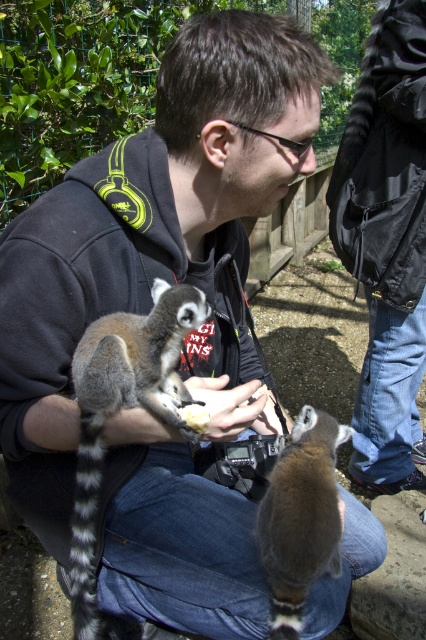
What do you see at coordinates (123, 406) in the screenshot? I see `ring-tailed lemur at left` at bounding box center [123, 406].

Does ring-tailed lemur at left appear on the right side of ring-tailed lemur at center?

In fact, ring-tailed lemur at left is to the left of ring-tailed lemur at center.

Find the location of a particular element. This screenshot has width=426, height=640. ring-tailed lemur at left is located at coordinates (123, 406).

This screenshot has width=426, height=640. In order to click on ring-tailed lemur at left in this screenshot , I will do `click(123, 406)`.

Is black synthetic jacket at upper right below ring-tailed lemur at left?

Incorrect, black synthetic jacket at upper right is not positioned below ring-tailed lemur at left.

Consider the image. Between black synthetic jacket at upper right and ring-tailed lemur at left, which one appears on the left side from the viewer's perspective?

ring-tailed lemur at left is more to the left.

Which is in front, point (423, 209) or point (80, 620)?

Point (80, 620)

Image resolution: width=426 pixels, height=640 pixels. What are the coordinates of `black synthetic jacket at upper right` in the screenshot? It's located at (385, 161).

Looking at this image, which is below, black synthetic jacket at upper right or ring-tailed lemur at center?

Positioned lower is ring-tailed lemur at center.

Who is taller, black synthetic jacket at upper right or ring-tailed lemur at center?

black synthetic jacket at upper right is taller.

Is point (380, 216) closer to viewer compared to point (299, 493)?

No.

Locate an element on the screen. The height and width of the screenshot is (640, 426). black synthetic jacket at upper right is located at coordinates (385, 161).